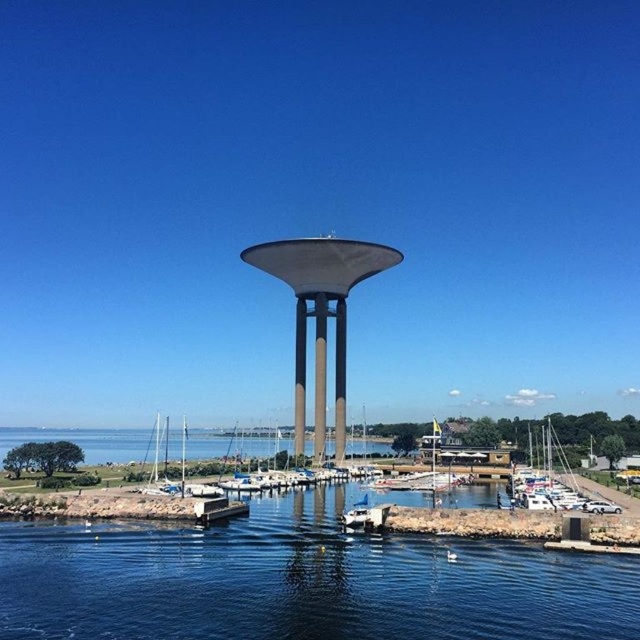
This screenshot has width=640, height=640. What are the coordinates of `blue water at center` in the screenshot? It's located at (300, 580).

Can you confirm if blue water at center is positioned below brown concrete pillar at center?

Yes, blue water at center is below brown concrete pillar at center.

Is point (602, 621) behind point (340, 353)?

That is False.

Locate an element on the screen. This screenshot has height=640, width=640. blue water at center is located at coordinates (300, 580).

Can you confirm if smooth concrete observation tower at center is shorter than sleek metallic tower at center?

In fact, smooth concrete observation tower at center may be taller than sleek metallic tower at center.

Between smooth concrete observation tower at center and sleek metallic tower at center, which one appears on the left side from the viewer's perspective?

smooth concrete observation tower at center is more to the left.

Is point (310, 244) behind point (324, 372)?

That is False.

Find the location of a particular element. The image size is (640, 640). smooth concrete observation tower at center is located at coordinates (321, 314).

Is white matte sailboat at lower right above matte gray pillar at center?

Incorrect, white matte sailboat at lower right is not positioned above matte gray pillar at center.

From the picture: Does white matte sailboat at lower right appear on the right side of matte gray pillar at center?

Yes, white matte sailboat at lower right is to the right of matte gray pillar at center.

Describe the element at coordinates (548, 460) in the screenshot. The width and height of the screenshot is (640, 640). I see `white matte sailboat at lower right` at that location.

Where is `white matte sailboat at lower right`? white matte sailboat at lower right is located at coordinates (548, 460).